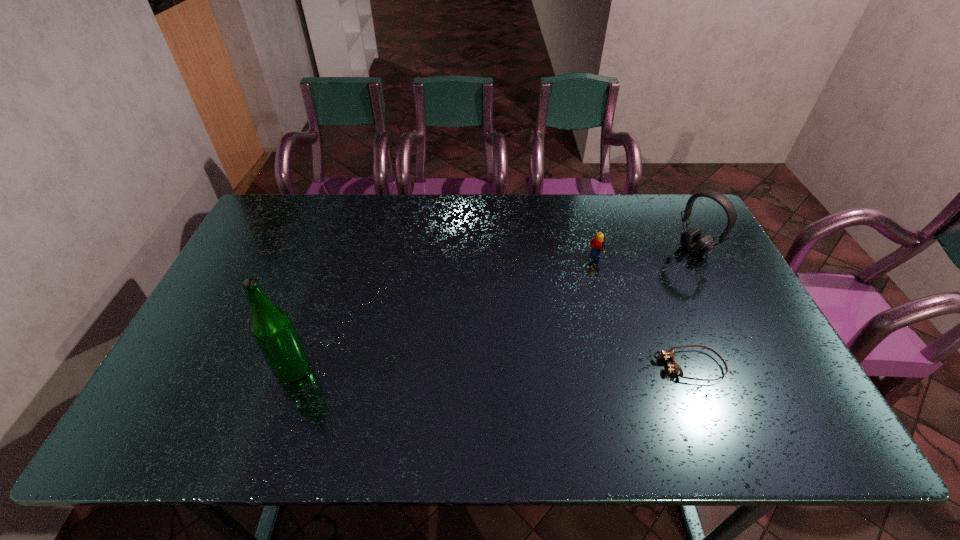
The image size is (960, 540). I want to click on vacant space located 0.130m on the label of the beer bottle, so click(x=224, y=370).

Locate an element on the screen. free space located 0.390m on the front lenses and sides of the shortest object is located at coordinates (496, 366).

At what (x,y) coordinates should I click in order to perform the action: click on free space located 0.330m on the front lenses and sides of the shortest object. Please return your answer as a coordinate pair (x, y). This screenshot has width=960, height=540. Looking at the image, I should click on (521, 366).

Locate an element on the screen. This screenshot has width=960, height=540. vacant space located on the front lenses and sides of the shortest object is located at coordinates (529, 366).

Where is `vacant space situated 0.380m on the front-facing side of the second tallest object`? Image resolution: width=960 pixels, height=540 pixels. vacant space situated 0.380m on the front-facing side of the second tallest object is located at coordinates (598, 313).

I want to click on vacant region located 0.400m on the front-facing side of the second tallest object, so click(x=593, y=316).

Where is `free space located on the front-facing side of the second tallest object`? free space located on the front-facing side of the second tallest object is located at coordinates (620, 299).

Identify the location of vacant area situated on the front-facing side of the Lego. (568, 326).

Image resolution: width=960 pixels, height=540 pixels. I want to click on free region located 0.160m on the front-facing side of the Lego, so click(579, 303).

You are a GUI agent. You are given a task and a screenshot of the screen. Output one action in this format:
    pyautogui.click(x=<x>, y=<y>)
    Task: Click on the vacant area located on the front-facing side of the Lego
    Image resolution: width=960 pixels, height=540 pixels.
    Given the screenshot: What is the action you would take?
    pyautogui.click(x=569, y=323)